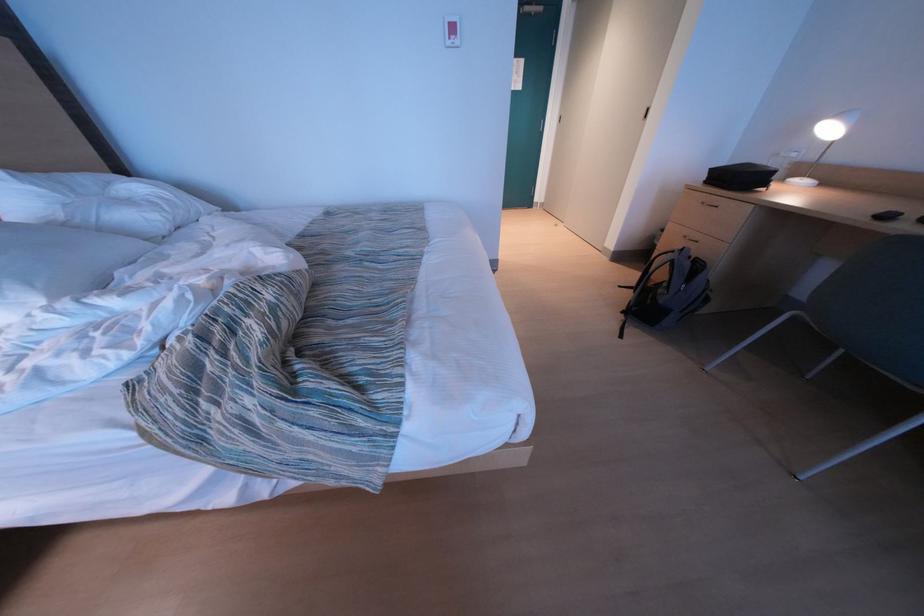
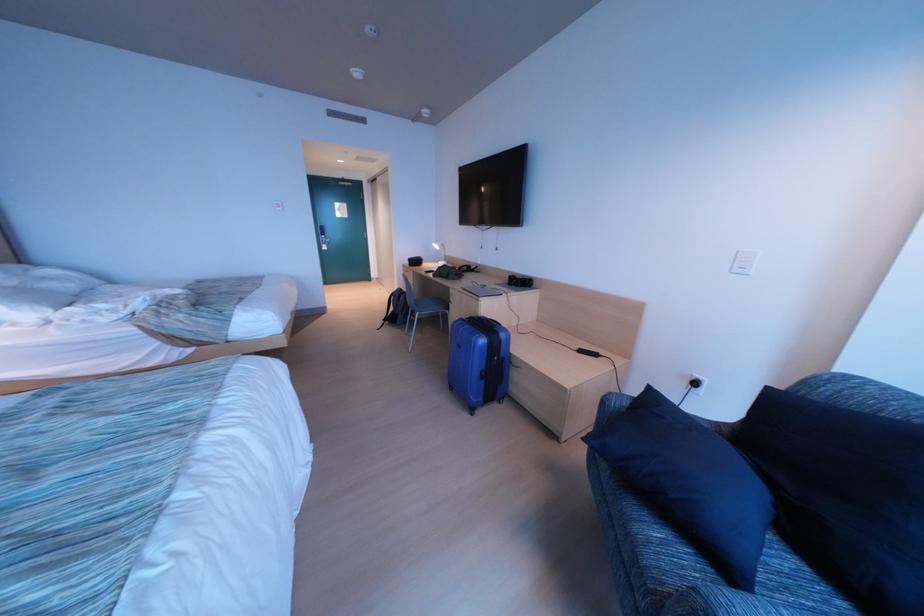
Which direction would the cameraman need to move to produce the second image?

The movement direction of the cameraman is right, backward.